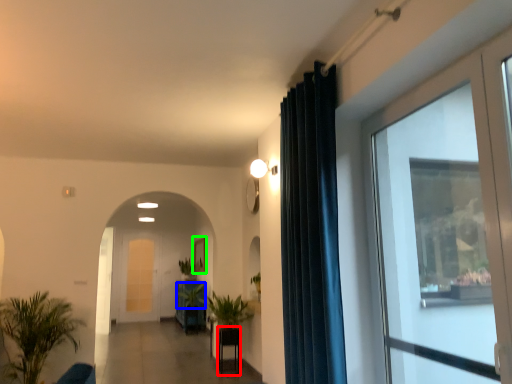
Question: Which object is positioned farthest from furniture (highlighted by a red box)? Select from plant (highlighted by a blue box) and picture frame (highlighted by a green box).

Choices:
 (A) plant
 (B) picture frame

Answer: (B)